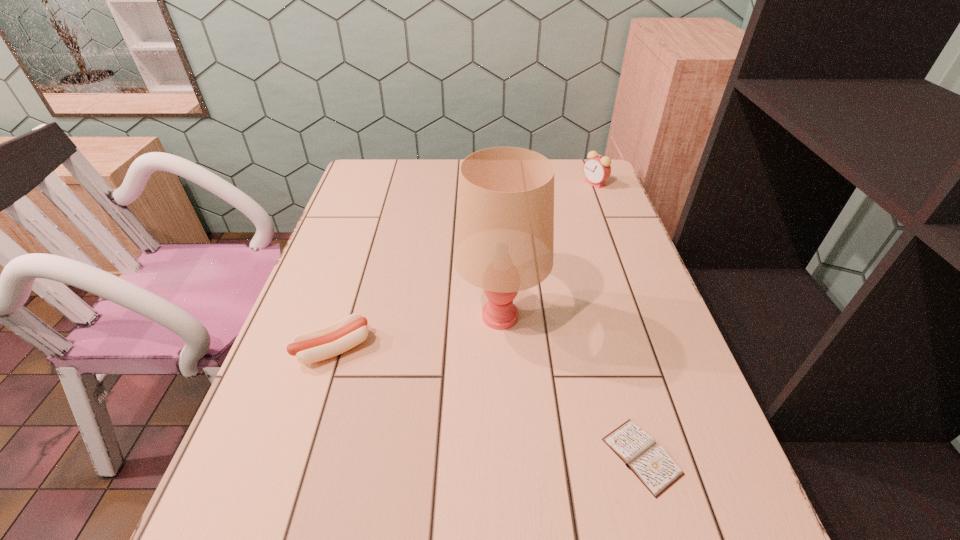
This screenshot has height=540, width=960. Identify the location of free space located on the face of the alarm clock. (500, 184).

Where is `vacant area situated on the face of the alarm clock`? The height and width of the screenshot is (540, 960). vacant area situated on the face of the alarm clock is located at coordinates (473, 184).

This screenshot has width=960, height=540. I want to click on blank area located on the front of the sausage, so click(x=293, y=481).

You are a GUI agent. You are given a task and a screenshot of the screen. Output one action in this format:
    pyautogui.click(x=<x>, y=<y>)
    Task: Click on the vacant space located on the back of the diary
    Image resolution: width=960 pixels, height=540 pixels.
    Given the screenshot: What is the action you would take?
    pyautogui.click(x=606, y=327)

Where is `object located at the far edge`? Image resolution: width=960 pixels, height=540 pixels. object located at the far edge is located at coordinates (597, 169).

At what (x,y) coordinates should I click in order to perform the action: click on object positioned at the left edge. Please return your answer as a coordinate pair (x, y). Looking at the image, I should click on (337, 338).

The height and width of the screenshot is (540, 960). In order to click on alarm clock at the right edge in this screenshot , I will do `click(597, 169)`.

Where is `diary that is positioned at the right edge`? The image size is (960, 540). diary that is positioned at the right edge is located at coordinates click(x=637, y=449).

Image resolution: width=960 pixels, height=540 pixels. I want to click on object present at the far right corner, so click(x=597, y=169).

Locate an element on the screen. This screenshot has height=540, width=960. vacant space at the far edge of the desktop is located at coordinates (449, 176).